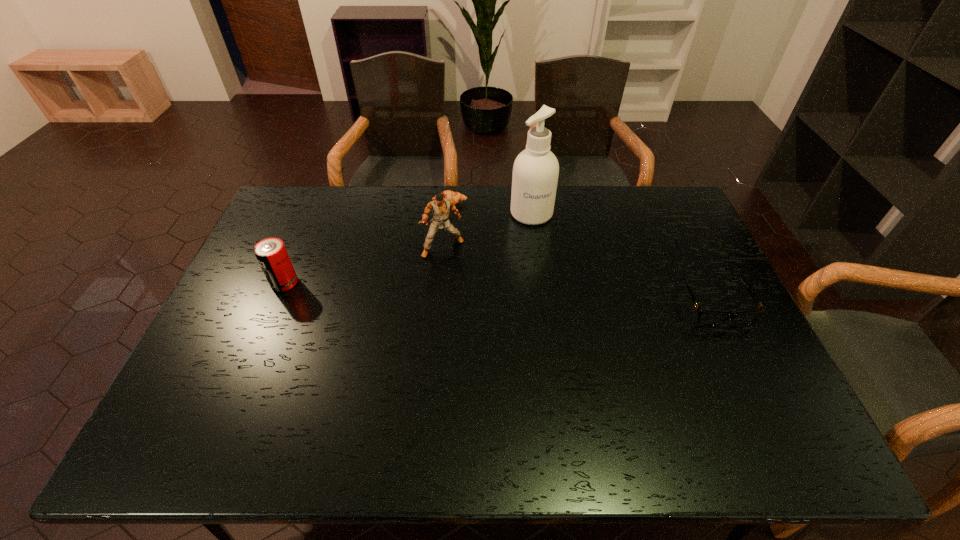
Locate an element on the screen. The image size is (960, 540). free space that is in between the fourth tallest object and the cleansing agent is located at coordinates (623, 260).

Locate an element on the screen. The width and height of the screenshot is (960, 540). free spot between the leftmost object and the second tallest object is located at coordinates (364, 265).

The width and height of the screenshot is (960, 540). In order to click on vacant space that is in between the third tallest object and the shortest object in this screenshot , I will do `click(368, 243)`.

This screenshot has width=960, height=540. Identify the location of free spot between the pastry and the sunglasses. click(x=582, y=254).

In order to click on vacant area that lies between the cleansing agent and the shortest object in this screenshot , I will do `click(491, 208)`.

Where is `free spot between the leftmost object and the rightmost object`? free spot between the leftmost object and the rightmost object is located at coordinates (499, 294).

At what (x,y) coordinates should I click in order to perform the action: click on free space between the can and the third nearest object. Please return your answer as a coordinate pair (x, y). Looking at the image, I should click on (364, 265).

Where is `blank region between the leftmost object and the rightmost object`? The image size is (960, 540). blank region between the leftmost object and the rightmost object is located at coordinates (499, 294).

This screenshot has height=540, width=960. What are the coordinates of `empty location between the pastry and the tallest object` in the screenshot? It's located at (491, 208).

Point out which object is positioned as the third nearest to the pastry. Please provide its 2D coordinates. Your answer should be formatted as a tuple, i.e. [(x, y)], where the tuple contains the x and y coordinates of a point satisfying the conditions above.

[(271, 253)]